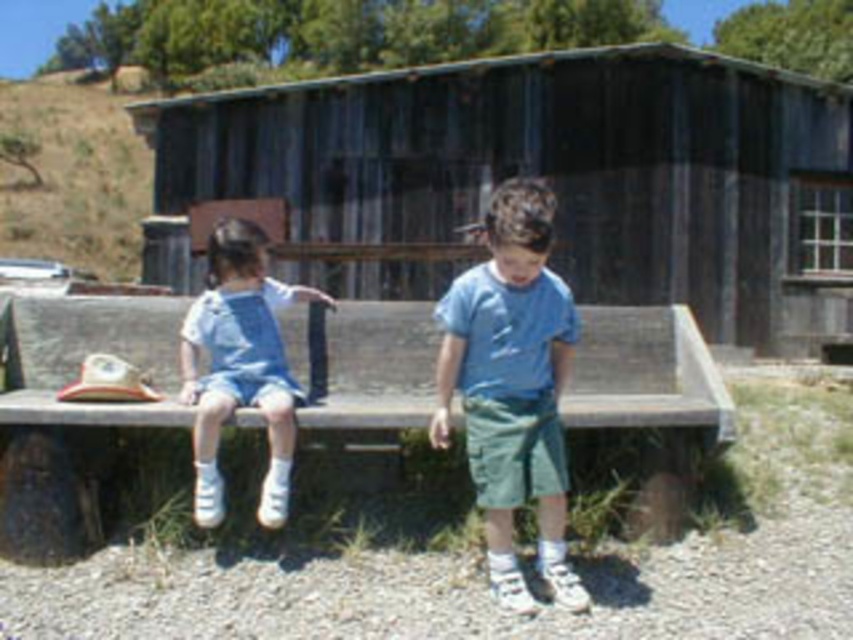
Question: Which of these objects is positioned closest to the wooden bench at center?

Choices:
 (A) blue cotton shirt at center
 (B) light blue denim overalls at left

Answer: (B)

Question: Can you confirm if weathered wood hut at center is positioned above light blue denim overalls at left?

Choices:
 (A) no
 (B) yes

Answer: (B)

Question: Considering the real-world distances, which object is closest to the weathered wood hut at center?

Choices:
 (A) light blue denim overalls at left
 (B) blue cotton shirt at center
 (C) wooden bench at center

Answer: (A)

Question: Where is weathered wood hut at center located in relation to wooden bench at center in the image?

Choices:
 (A) below
 (B) above

Answer: (B)

Question: Does wooden bench at center lie behind blue cotton shirt at center?

Choices:
 (A) yes
 (B) no

Answer: (A)

Question: Which object is farther from the camera taking this photo?

Choices:
 (A) blue cotton shirt at center
 (B) light blue denim overalls at left

Answer: (B)